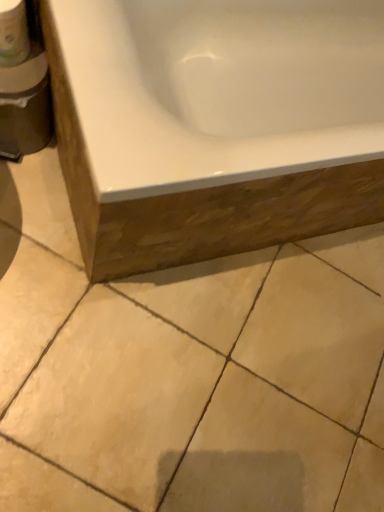
At what (x,y) coordinates should I click in order to perform the action: click on beige ceramic tile at lower center. Please return your answer as a coordinate pair (x, y). This screenshot has height=512, width=384. Looking at the image, I should click on (209, 385).

This screenshot has width=384, height=512. What are the coordinates of `white glossy bathtub at upper center` in the screenshot? It's located at [x=215, y=124].

Locate an element on the screen. This screenshot has height=512, width=384. ceramic tile lying behind the white glossy bathtub at upper center is located at coordinates (209, 385).

Looking at this image, is beige ceramic tile at lower center in contact with white glossy bathtub at upper center?

No, beige ceramic tile at lower center is not making contact with white glossy bathtub at upper center.

In terms of width, does beige ceramic tile at lower center look wider or thinner when compared to white glossy bathtub at upper center?

beige ceramic tile at lower center is wider than white glossy bathtub at upper center.

Is beige ceramic tile at lower center surrounded by white glossy bathtub at upper center?

No.

Where is `ceramic tile below the white glossy bathtub at upper center (from a real-world perspective)`? This screenshot has width=384, height=512. ceramic tile below the white glossy bathtub at upper center (from a real-world perspective) is located at coordinates (209, 385).

Is white glossy bathtub at upper center wider than beige ceramic tile at lower center?

Incorrect, the width of white glossy bathtub at upper center does not surpass that of beige ceramic tile at lower center.

Can beige ceramic tile at lower center be found inside white matte toilet paper at upper left?

No.

Can you confirm if white matte toilet paper at upper left is shorter than beige ceramic tile at lower center?

No.

Considering the sizes of objects white matte toilet paper at upper left and beige ceramic tile at lower center in the image provided, who is smaller, white matte toilet paper at upper left or beige ceramic tile at lower center?

Smaller between the two is white matte toilet paper at upper left.

In the scene shown: In the image, is white matte toilet paper at upper left positioned in front of or behind beige ceramic tile at lower center?

white matte toilet paper at upper left is in front of beige ceramic tile at lower center.

Is the depth of white glossy bathtub at upper center greater than that of white matte toilet paper at upper left?

No, white glossy bathtub at upper center is closer to the viewer.

Does point (211, 67) come closer to viewer compared to point (26, 21)?

No, it is behind (26, 21).

Is white glossy bathtub at upper center smaller than white matte toilet paper at upper left?

Incorrect, white glossy bathtub at upper center is not smaller in size than white matte toilet paper at upper left.

Considering the sizes of objects beige ceramic tile at lower center and white matte toilet paper at upper left in the image provided, who is wider, beige ceramic tile at lower center or white matte toilet paper at upper left?

beige ceramic tile at lower center.

Looking at this image, how many degrees apart are the facing directions of beige ceramic tile at lower center and white matte toilet paper at upper left?

The angular difference between beige ceramic tile at lower center and white matte toilet paper at upper left is 90.5 degrees.

In the image, is beige ceramic tile at lower center positioned in front of or behind white matte toilet paper at upper left?

beige ceramic tile at lower center is behind white matte toilet paper at upper left.

In the scene shown: Which is more to the right, beige ceramic tile at lower center or white matte toilet paper at upper left?

beige ceramic tile at lower center is more to the right.

Which of these two, white matte toilet paper at upper left or white glossy bathtub at upper center, stands taller?

Standing taller between the two is white glossy bathtub at upper center.

Can you tell me how much white matte toilet paper at upper left and white glossy bathtub at upper center differ in facing direction?

white matte toilet paper at upper left and white glossy bathtub at upper center are facing 0.00105 degrees away from each other.

Is white matte toilet paper at upper left next to white glossy bathtub at upper center?

No, white matte toilet paper at upper left is not beside white glossy bathtub at upper center.

The width and height of the screenshot is (384, 512). Identify the location of toilet paper that appears on the left of white glossy bathtub at upper center. (13, 33).

I want to click on bathtub that is on the right side of beige ceramic tile at lower center, so click(215, 124).

Locate an element on the screen. This screenshot has width=384, height=512. bathtub above the beige ceramic tile at lower center (from the image's perspective) is located at coordinates click(x=215, y=124).

Looking at the image, which one is located closer to white glossy bathtub at upper center, beige ceramic tile at lower center or white matte toilet paper at upper left?

The object closer to white glossy bathtub at upper center is beige ceramic tile at lower center.

From the image, which object appears to be farther from white glossy bathtub at upper center, white matte toilet paper at upper left or beige ceramic tile at lower center?

white matte toilet paper at upper left lies further to white glossy bathtub at upper center than the other object.

Based on their spatial positions, is white glossy bathtub at upper center or white matte toilet paper at upper left closer to beige ceramic tile at lower center?

white glossy bathtub at upper center is closer to beige ceramic tile at lower center.

Looking at the image, which one is located closer to white matte toilet paper at upper left, white glossy bathtub at upper center or beige ceramic tile at lower center?

white glossy bathtub at upper center lies closer to white matte toilet paper at upper left than the other object.

Considering their positions, is white matte toilet paper at upper left positioned further to beige ceramic tile at lower center than white glossy bathtub at upper center?

white matte toilet paper at upper left.

When comparing their distances from white matte toilet paper at upper left, does beige ceramic tile at lower center or white glossy bathtub at upper center seem further?

beige ceramic tile at lower center.

This screenshot has width=384, height=512. What are the coordinates of `bathtub between white matte toilet paper at upper left and beige ceramic tile at lower center from top to bottom` in the screenshot? It's located at (215, 124).